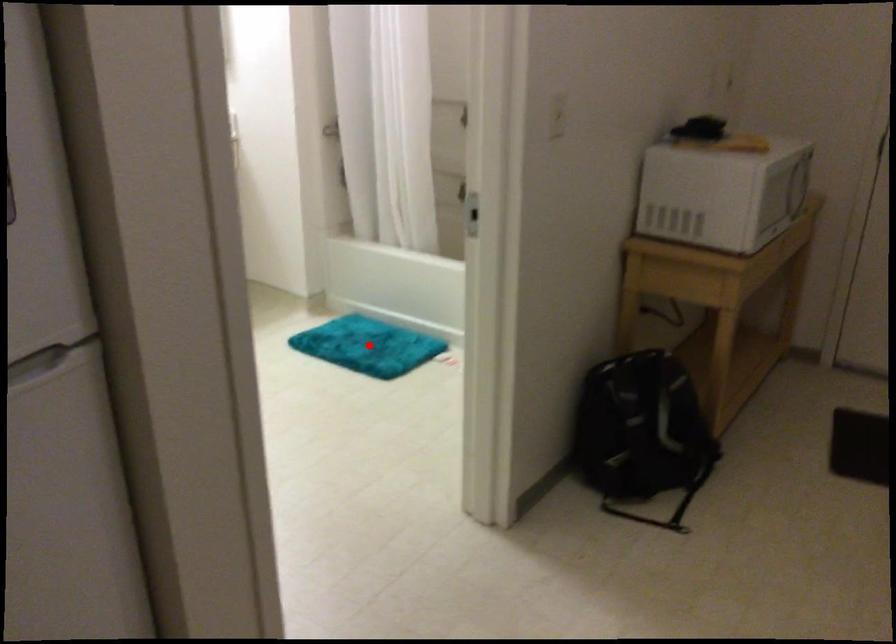
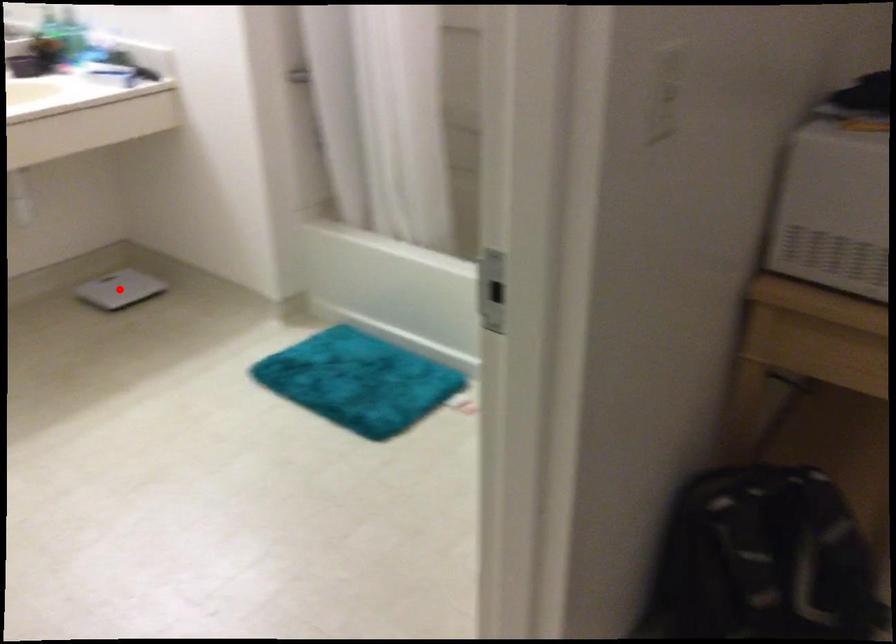
I am providing you with two images of the same scene from different viewpoints. A red point is marked on the first image and another point is marked on the second image. Is the red point in image1 aligned with the point shown in image2?

No